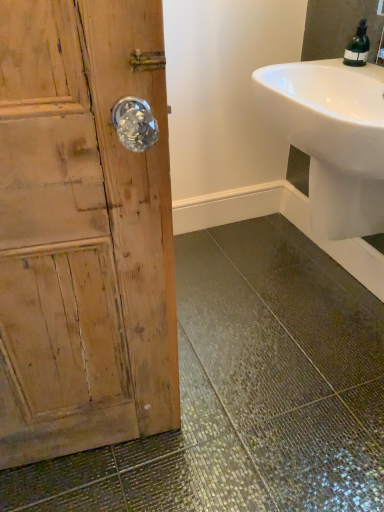
The width and height of the screenshot is (384, 512). I want to click on green matte bottle at upper right, so click(358, 47).

Describe the element at coordinates (358, 47) in the screenshot. This screenshot has width=384, height=512. I see `green matte bottle at upper right` at that location.

Measure the distance between point (383, 170) and camera.

Point (383, 170) and camera are 39.29 inches apart from each other.

Find the location of a particular element. This screenshot has height=512, width=384. white glossy sink at upper right is located at coordinates 332,138.

What do you see at coordinates (332, 138) in the screenshot? I see `white glossy sink at upper right` at bounding box center [332, 138].

Identify the location of green matte bottle at upper right. Image resolution: width=384 pixels, height=512 pixels. [x=358, y=47].

From the picture: Considering the positions of objects white glossy sink at upper right and green matte bottle at upper right in the image provided, who is more to the right, white glossy sink at upper right or green matte bottle at upper right?

Positioned to the right is green matte bottle at upper right.

Considering their positions, is white glossy sink at upper right located in front of or behind green matte bottle at upper right?

white glossy sink at upper right is positioned closer to the viewer than green matte bottle at upper right.

Which point is more distant from viewer, (376, 102) or (351, 48)?

Point (351, 48)

From the image's perspective, does white glossy sink at upper right appear higher than green matte bottle at upper right?

Actually, white glossy sink at upper right appears below green matte bottle at upper right in the image.

From a real-world perspective, is white glossy sink at upper right positioned under green matte bottle at upper right based on gravity?

Yes.

Looking at their sizes, would you say white glossy sink at upper right is wider or thinner than green matte bottle at upper right?

Considering their sizes, white glossy sink at upper right looks broader than green matte bottle at upper right.

Which of these two, white glossy sink at upper right or green matte bottle at upper right, stands taller?

With more height is white glossy sink at upper right.

Is white glossy sink at upper right smaller than green matte bottle at upper right?

No, white glossy sink at upper right is not smaller than green matte bottle at upper right.

Is green matte bottle at upper right surrounded by white glossy sink at upper right?

Actually, green matte bottle at upper right is outside white glossy sink at upper right.

Are white glossy sink at upper right and green matte bottle at upper right located far from each other?

white glossy sink at upper right is near green matte bottle at upper right, not far away.

Could you tell me if white glossy sink at upper right is facing green matte bottle at upper right?

No, white glossy sink at upper right is not facing towards green matte bottle at upper right.

The image size is (384, 512). Find the location of `soap dispenser above the white glossy sink at upper right (from the image's perspective)`. soap dispenser above the white glossy sink at upper right (from the image's perspective) is located at coordinates (358, 47).

Based on the photo, which object is positioned more to the right, green matte bottle at upper right or white glossy sink at upper right?

green matte bottle at upper right is more to the right.

Is green matte bottle at upper right further to the viewer compared to white glossy sink at upper right?

Yes.

Which point is more forward, (355,50) or (329,232)?

The point (355,50) is closer to the camera.

From the image's perspective, is green matte bottle at upper right under white glossy sink at upper right?

No, from the image's perspective, green matte bottle at upper right is not beneath white glossy sink at upper right.

From a real-world perspective, is green matte bottle at upper right over white glossy sink at upper right?

Yes, from a real-world perspective, green matte bottle at upper right is on top of white glossy sink at upper right.

Does green matte bottle at upper right have a greater width compared to white glossy sink at upper right?

Incorrect, the width of green matte bottle at upper right does not surpass that of white glossy sink at upper right.

Can you confirm if green matte bottle at upper right is shorter than white glossy sink at upper right?

Yes.

Which of these two, green matte bottle at upper right or white glossy sink at upper right, is smaller?

Smaller between the two is green matte bottle at upper right.

Is green matte bottle at upper right situated inside white glossy sink at upper right or outside?

The correct answer is: outside.

Is green matte bottle at upper right far from white glossy sink at upper right?

That's not correct — green matte bottle at upper right is a little close to white glossy sink at upper right.

Could you tell me if green matte bottle at upper right is facing white glossy sink at upper right?

No, green matte bottle at upper right is not oriented towards white glossy sink at upper right.

How different are the orientations of green matte bottle at upper right and white glossy sink at upper right in degrees?

3.4 degrees separate the facing orientations of green matte bottle at upper right and white glossy sink at upper right.

Where is `sink to the left of green matte bottle at upper right`? The height and width of the screenshot is (512, 384). sink to the left of green matte bottle at upper right is located at coordinates (332, 138).

Identify the location of soap dispenser that is on the right side of white glossy sink at upper right. (358, 47).

The height and width of the screenshot is (512, 384). Identify the location of sink below the green matte bottle at upper right (from the image's perspective). (332, 138).